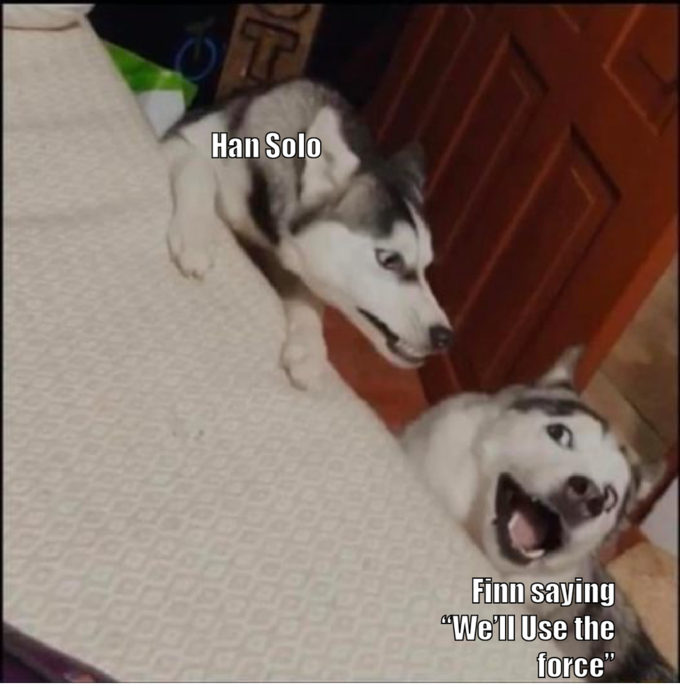
Locate an element on the screen. This screenshot has height=688, width=680. brown wall is located at coordinates (653, 332).